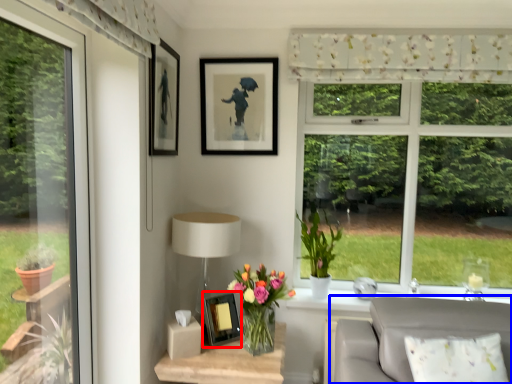
Question: Which object appears farthest to the camera in this image, picture frame (highlighted by a red box) or studio couch (highlighted by a blue box)?

Choices:
 (A) picture frame
 (B) studio couch

Answer: (A)